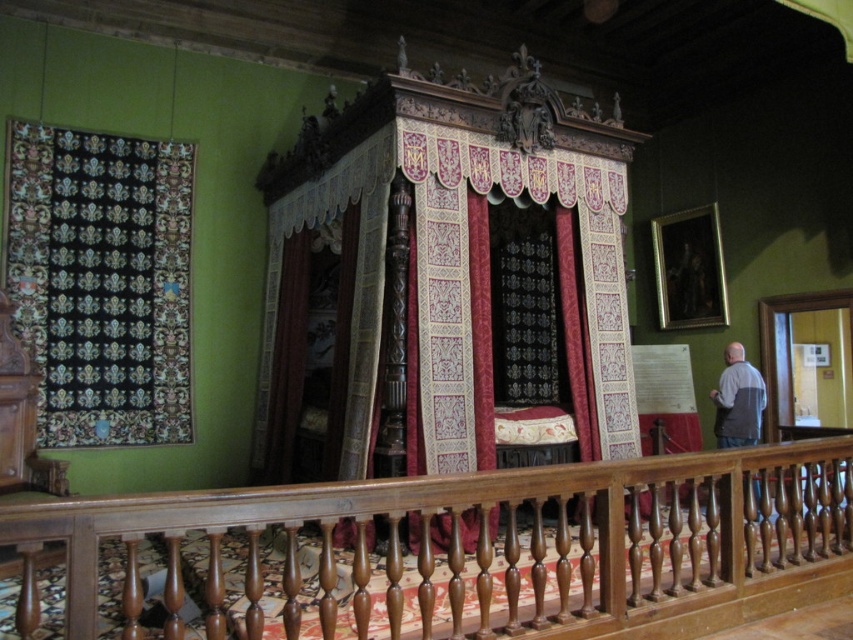
Which of these two, wooden balustrade at center or velvet tapestry bed at center, stands shorter?

Standing shorter between the two is wooden balustrade at center.

Which is behind, point (746, 584) or point (404, 292)?

Positioned behind is point (404, 292).

Locate an element on the screen. This screenshot has width=853, height=640. wooden balustrade at center is located at coordinates (462, 552).

The height and width of the screenshot is (640, 853). Describe the element at coordinates (462, 552) in the screenshot. I see `wooden balustrade at center` at that location.

Who is more distant from viewer, (784, 484) or (12, 268)?

Positioned behind is point (12, 268).

Does point (495, 636) lie behind point (68, 376)?

No.

The width and height of the screenshot is (853, 640). Find the location of `wooden balustrade at center`. wooden balustrade at center is located at coordinates (462, 552).

Between black velvet tapestry at left and gray fabric apron at right, which one appears on the right side from the viewer's perspective?

Positioned to the right is gray fabric apron at right.

The width and height of the screenshot is (853, 640). I want to click on black velvet tapestry at left, so (102, 282).

Locate an element on the screen. The height and width of the screenshot is (640, 853). black velvet tapestry at left is located at coordinates (102, 282).

Identify the location of black velvet tapestry at left. Image resolution: width=853 pixels, height=640 pixels. (102, 282).